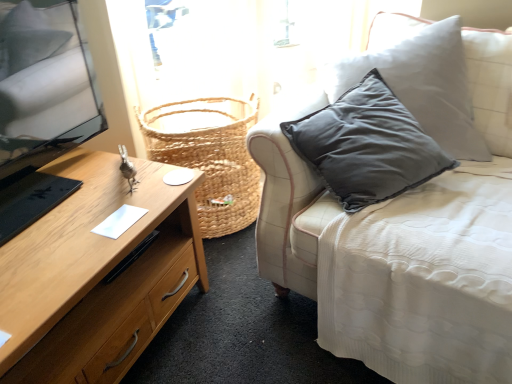
This screenshot has width=512, height=384. Describe the element at coordinates (402, 245) in the screenshot. I see `white fabric couch at center` at that location.

The width and height of the screenshot is (512, 384). In order to click on woven natural basket at center in this screenshot , I will do `click(210, 158)`.

Where is `wooden desk at left`? The height and width of the screenshot is (384, 512). wooden desk at left is located at coordinates (95, 273).

Is white fabric couch at center at the back of woven natural basket at center?

That's not correct — woven natural basket at center is not looking away from white fabric couch at center.

From a real-world perspective, does woven natural basket at center sit lower than white fabric couch at center?

Correct, in the physical world, woven natural basket at center is lower than white fabric couch at center.

Between woven natural basket at center and white fabric couch at center, which one is positioned behind?

woven natural basket at center is further away from the camera.

Looking at their sizes, would you say woven natural basket at center is wider or thinner than white fabric couch at center?

Considering their sizes, woven natural basket at center looks slimmer than white fabric couch at center.

From a real-world perspective, is white fabric couch at center physically located above or below wooden desk at left?

From a real-world perspective, white fabric couch at center is physically above wooden desk at left.

Is white fabric couch at center next to wooden desk at left and touching it?

They are not placed beside each other.

Considering the positions of point (328, 297) and point (109, 268), is point (328, 297) closer or farther from the camera than point (109, 268)?

Point (328, 297) appears to be farther away from the viewer than point (109, 268).

Who is taller, wooden desk at left or white fabric couch at center?

white fabric couch at center is taller.

The height and width of the screenshot is (384, 512). I want to click on desk on the left of white fabric couch at center, so click(x=95, y=273).

Is wooden desk at left positioned far away from white fabric couch at center?

No, wooden desk at left is not far from white fabric couch at center.

From a real-world perspective, does wooden desk at left sit lower than woven natural basket at center?

Yes.

Is wooden desk at left facing away from woven natural basket at center?

That's not correct — wooden desk at left is not looking away from woven natural basket at center.

Which object is closer to the camera taking this photo, wooden desk at left or woven natural basket at center?

wooden desk at left is more forward.

From the picture: From a real-world perspective, between woven natural basket at center and wooden desk at left, who is vertically lower?

wooden desk at left, from a real-world perspective.

Is woven natural basket at center inside or outside of wooden desk at left?

The correct answer is: outside.

Could you tell me if woven natural basket at center is turned towards wooden desk at left?

No, woven natural basket at center is not turned towards wooden desk at left.

Consider the image. Is white fabric couch at center inside or outside of woven natural basket at center?

white fabric couch at center is outside woven natural basket at center.

Which object is further away from the camera taking this photo, white fabric couch at center or woven natural basket at center?

woven natural basket at center.

What's the angular difference between white fabric couch at center and woven natural basket at center's facing directions?

white fabric couch at center and woven natural basket at center are facing 49.3 degrees away from each other.

Does white fabric couch at center have a greater width compared to woven natural basket at center?

Yes, white fabric couch at center is wider than woven natural basket at center.

Identify the location of basket on the left of white fabric couch at center. The image size is (512, 384). (210, 158).

The image size is (512, 384). In order to click on desk below the white fabric couch at center (from the image's perspective) in this screenshot , I will do `click(95, 273)`.

From the image, which object appears to be nearer to white fabric couch at center, woven natural basket at center or wooden desk at left?

wooden desk at left.

Considering their positions, is white fabric couch at center positioned closer to wooden desk at left than woven natural basket at center?

Based on the image, woven natural basket at center appears to be nearer to wooden desk at left.

Based on their spatial positions, is wooden desk at left or white fabric couch at center further from woven natural basket at center?

white fabric couch at center is positioned further to the anchor woven natural basket at center.

Looking at the image, which one is located further to wooden desk at left, woven natural basket at center or white fabric couch at center?

white fabric couch at center.

Estimate the real-world distances between objects in this image. Which object is further from woven natural basket at center, white fabric couch at center or wooden desk at left?

Based on the image, white fabric couch at center appears to be further to woven natural basket at center.

Based on their spatial positions, is wooden desk at left or woven natural basket at center closer to white fabric couch at center?

wooden desk at left.

You are a GUI agent. You are given a task and a screenshot of the screen. Output one action in this format:
    pyautogui.click(x=<x>, y=<y>)
    Task: Click on the basket between wooden desk at left and white fabric couch at center
    Image resolution: width=512 pixels, height=384 pixels.
    Given the screenshot: What is the action you would take?
    (210, 158)